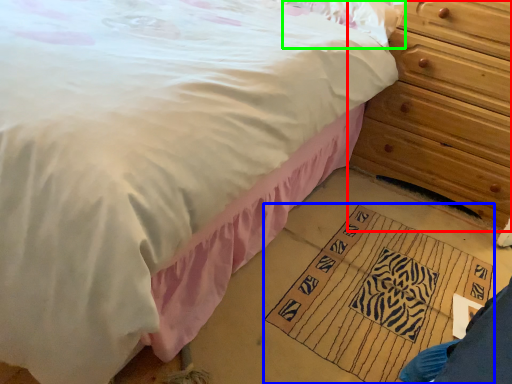
Question: Which is farther away from chest of drawers (highlighted by a red box)? doormat (highlighted by a blue box) or pillow (highlighted by a green box)?

Choices:
 (A) doormat
 (B) pillow

Answer: (A)